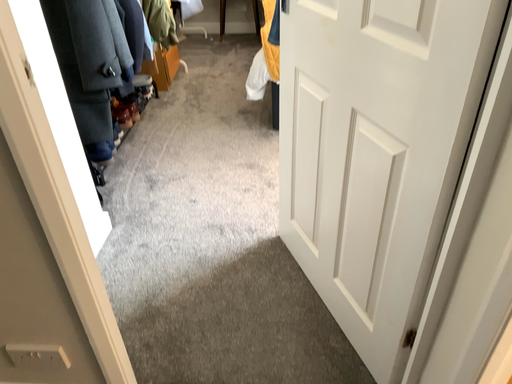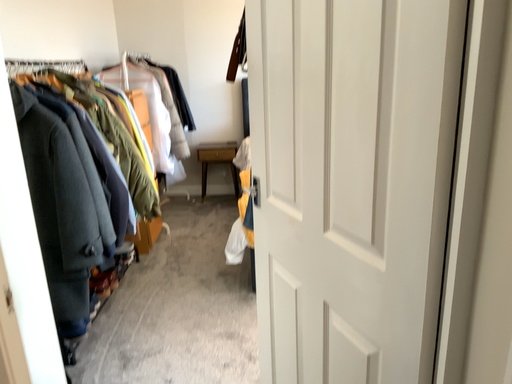
Question: Which way did the camera rotate in the video?

Choices:
 (A) rotated downward
 (B) rotated upward

Answer: (B)